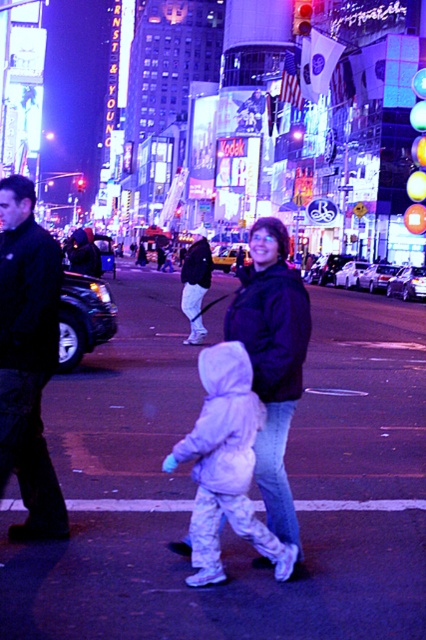
Question: Which of the following is the closest to the observer?

Choices:
 (A) (207, 436)
 (B) (304, 342)

Answer: (A)

Question: Is dark blue jacket at left in front of dark blue jacket at center?

Choices:
 (A) no
 (B) yes

Answer: (A)

Question: From the image, what is the correct spatial relationship of dark blue jacket at left in relation to white fleece jacket at center?

Choices:
 (A) left
 (B) right

Answer: (A)

Question: Does dark blue jacket at center have a greater width compared to white fleece jacket at center?

Choices:
 (A) no
 (B) yes

Answer: (A)

Question: Which is farther from the dark blue jacket at center?

Choices:
 (A) white fleece jacket at center
 (B) dark blue jacket at left

Answer: (B)

Question: Among these objects, which one is nearest to the camera?

Choices:
 (A) dark blue jacket at center
 (B) dark blue jacket at left

Answer: (A)